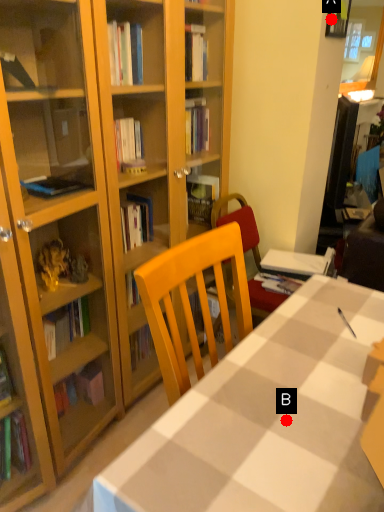
Question: Two points are circled on the image, labeled by A and B beside each circle. Which point is further to the camera?

Choices:
 (A) A is further
 (B) B is further

Answer: (A)